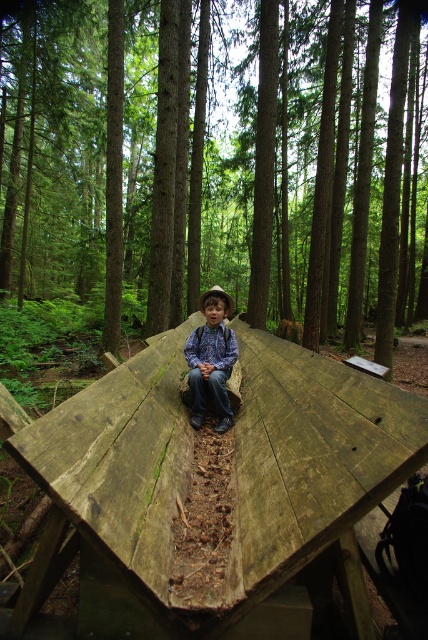
You are standing in the forest and want to sit on the wooden log at center. Based on its position, can you estimate where you should walk to find it?

The wooden log at center is located at point 0.266 along the horizontal axis and 0.495 along the vertical axis, so you should walk towards the middle section of the forest area slightly to the left and halfway up from the bottom to reach it.

Consider the image. You are standing at the point with coordinates point (199, 400) and want to walk towards the point with coordinates point (279, 614). Which direction should you move in relation to the forest scene?

You should move forward because point (279, 614) is in front of point (199, 400) in the forest scene.